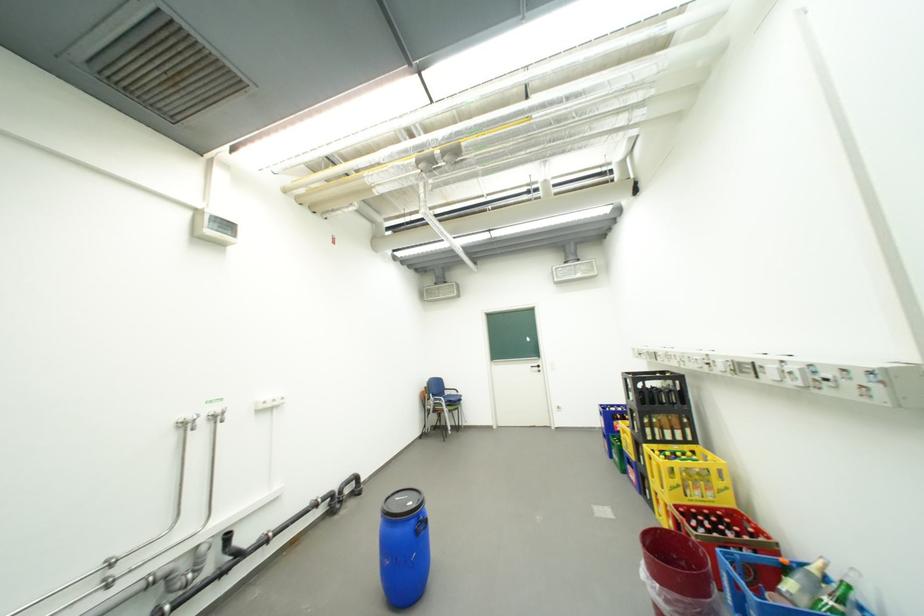
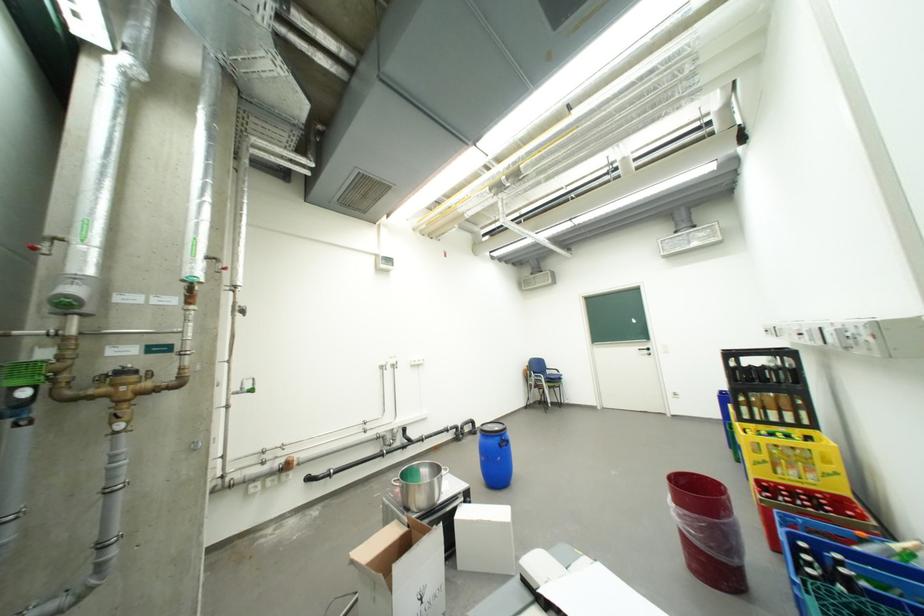
Where in the second image is the point corresponding to pixel 713 503 from the first image?

(810, 484)